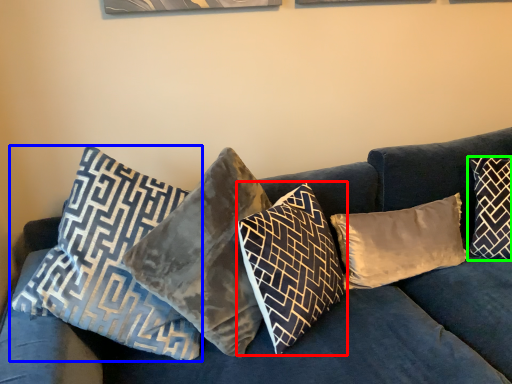
Question: Which object is the closest to the pillow (highlighted by a red box)? Choose among these: pillow (highlighted by a blue box) or pillow (highlighted by a green box).

Choices:
 (A) pillow
 (B) pillow

Answer: (A)